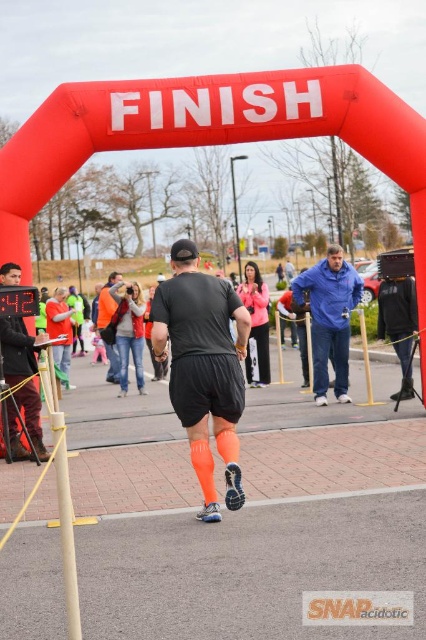
Question: Which of the following is the farthest from the observer?

Choices:
 (A) blue fleece jacket at center
 (B) matte black timer at center

Answer: (A)

Question: Is matte black shorts at center above orange reflective vest at center?

Choices:
 (A) yes
 (B) no

Answer: (A)

Question: Estimate the real-world distances between objects in this image. Which object is closer to the blue fleece jacket at center?

Choices:
 (A) matte black shorts at center
 (B) matte black timer at center
 (C) orange reflective vest at center
 (D) neon orange athletic socks at center

Answer: (D)

Question: Which of these objects is positioned farthest from the blue fleece jacket at center?

Choices:
 (A) neon orange athletic socks at center
 (B) orange reflective vest at center

Answer: (B)

Question: Is matte black shorts at center to the right of neon orange athletic socks at center from the viewer's perspective?

Choices:
 (A) yes
 (B) no

Answer: (B)

Question: Does matte black shorts at center appear on the right side of orange reflective vest at center?

Choices:
 (A) yes
 (B) no

Answer: (A)